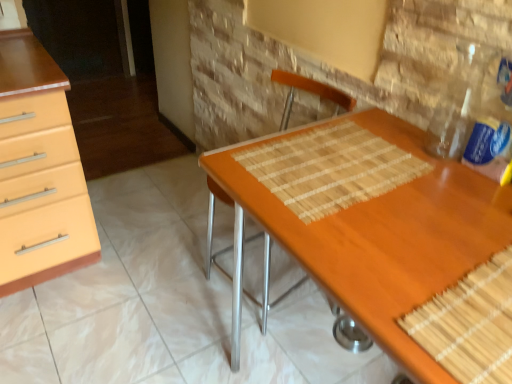
Locate an element on the screen. The image size is (512, 384). vacant area that lies between clear plastic bottle at upper right and bamboo placemat at center is located at coordinates (419, 175).